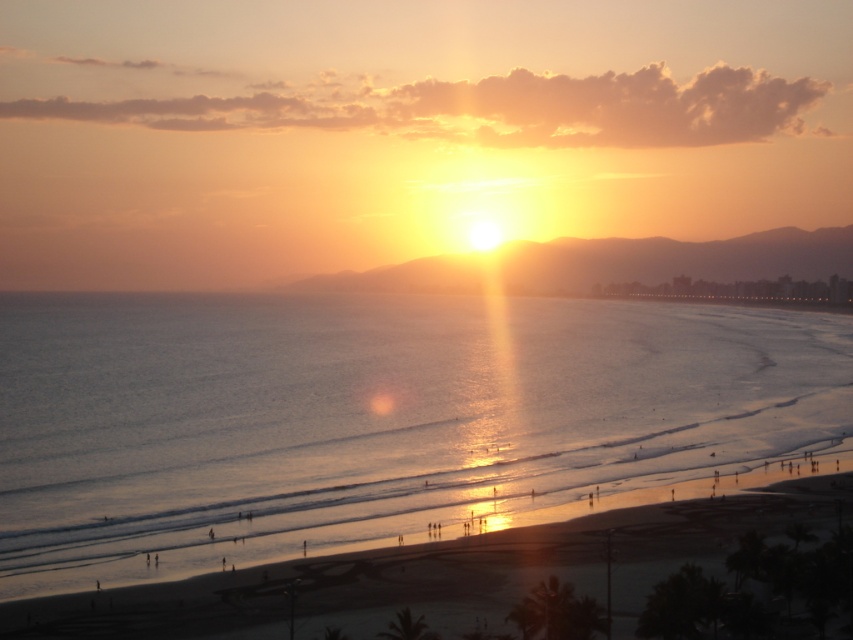
You are standing on the beach looking at the sunset. There is a point marked at coordinates (x=369, y=417). What can you see at that point?

At point (x=369, y=417), you can see shiny blue water at center.

You are standing on the beach and want to take a photo of the sunset. The shiny blue water at center is in your viewfinder. Where should you position your camera to capture the reflection of the sunset in the water?

Position your camera at the same height as the shiny blue water at center located at point (369, 417) to capture the reflection of the sunset in the water.

You are a photographer standing on the beach and want to capture both the point at coordinates point (837, 428) and the point at coordinates point (703, 611) in your shot. Which point is closer to your camera?

Point (703, 611) is closer to the camera because point (837, 428) is further away.